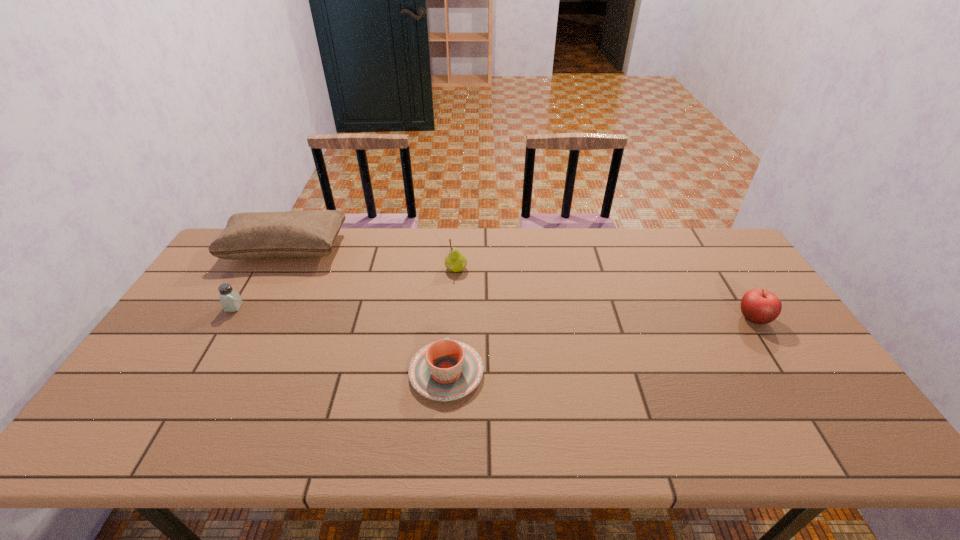
I want to click on cushion, so click(251, 235).

Locate an element on the screen. The image size is (960, 540). pear is located at coordinates (455, 261).

I want to click on the third tallest object, so click(x=759, y=306).

Identify the location of the rightmost object. This screenshot has height=540, width=960. (759, 306).

This screenshot has width=960, height=540. I want to click on saltshaker, so click(x=230, y=299).

Locate an element on the screen. The width and height of the screenshot is (960, 540). chinaware is located at coordinates (446, 370).

The height and width of the screenshot is (540, 960). I want to click on free spot located on the front of the cushion, so click(268, 281).

Locate an element on the screen. The image size is (960, 540). vacant area situated on the back of the pear is located at coordinates (457, 251).

This screenshot has width=960, height=540. I want to click on vacant area located on the back of the third shortest object, so click(720, 266).

Find the location of a particular element. The width and height of the screenshot is (960, 540). vacant region located 0.100m on the left of the saltshaker is located at coordinates (194, 307).